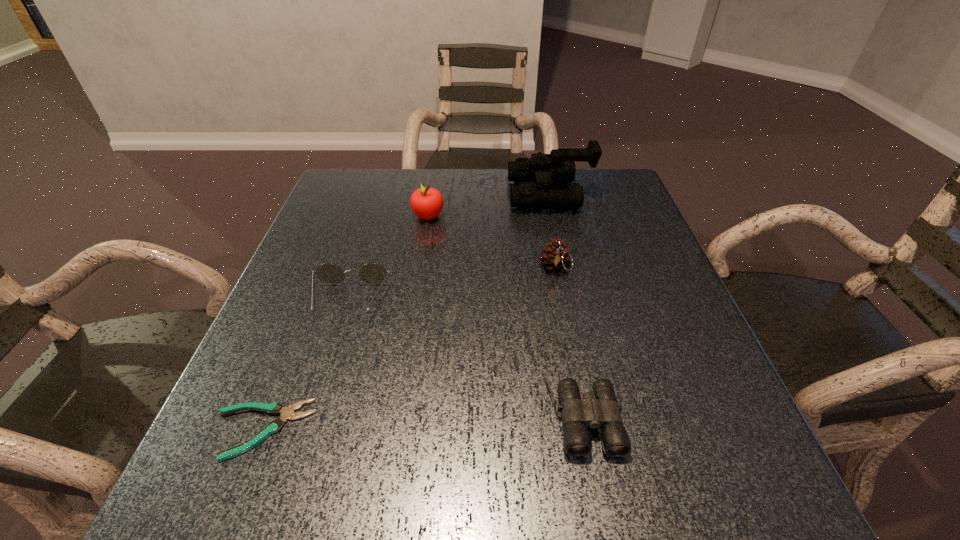
What are the coordinates of `apple that is at the far edge` in the screenshot? It's located at (427, 203).

Where is `object situated at the near edge`? The image size is (960, 540). object situated at the near edge is located at coordinates click(275, 408).

You are a GUI agent. You are given a task and a screenshot of the screen. Output one action in this format:
    pyautogui.click(x=<x>, y=<y>)
    Task: Click on the spectacles positioned at the left edge
    
    Given the screenshot: What is the action you would take?
    [372, 273]

Locate an element on the screen. The width and height of the screenshot is (960, 540). pliers at the left edge is located at coordinates (275, 408).

Locate an element on the screen. The width and height of the screenshot is (960, 540). object that is at the right edge is located at coordinates (559, 166).

The image size is (960, 540). What are the coordinates of `object that is at the near left corner` in the screenshot? It's located at (275, 408).

Image resolution: width=960 pixels, height=540 pixels. Identify the location of object present at the far right corner. (559, 166).

In the image, there is a desktop. At what (x,y) coordinates should I click in order to perform the action: click on vacant area at the far edge. Please return your answer as a coordinate pair (x, y). Image resolution: width=960 pixels, height=540 pixels. Looking at the image, I should click on (445, 201).

The image size is (960, 540). In the image, there is a desktop. What are the coordinates of `vacant region at the near edge` in the screenshot? It's located at (362, 472).

You are a GUI agent. You are given a task and a screenshot of the screen. Output one action in this format:
    pyautogui.click(x=<x>, y=<y>)
    Task: Click on the vacant space at the left edge of the desktop
    
    Given the screenshot: What is the action you would take?
    pyautogui.click(x=338, y=306)